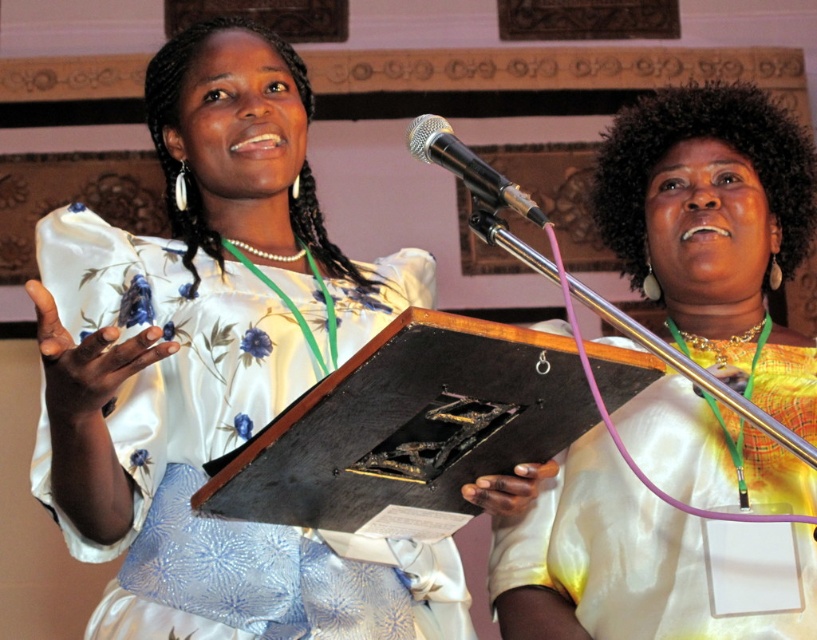
Question: Does black wood plaque at center have a larger size compared to metallic/metallic microphone at upper center?

Choices:
 (A) yes
 (B) no

Answer: (A)

Question: Which object appears closest to the camera in this image?

Choices:
 (A) metallic/metallic microphone at upper center
 (B) matte gold blouse at center
 (C) satin floral dress at center
 (D) black wood plaque at center

Answer: (D)

Question: Can you confirm if black wood plaque at center is positioned to the right of metallic/metallic microphone at upper center?

Choices:
 (A) yes
 (B) no

Answer: (B)

Question: Is matte gold blouse at center further to camera compared to black wood plaque at center?

Choices:
 (A) no
 (B) yes

Answer: (B)

Question: Considering the real-world distances, which object is farthest from the satin floral dress at center?

Choices:
 (A) metallic/metallic microphone at upper center
 (B) matte gold blouse at center
 (C) black wood plaque at center

Answer: (A)

Question: Based on their relative distances, which object is nearer to the matte gold blouse at center?

Choices:
 (A) satin floral dress at center
 (B) metallic/metallic microphone at upper center
 (C) black wood plaque at center

Answer: (C)